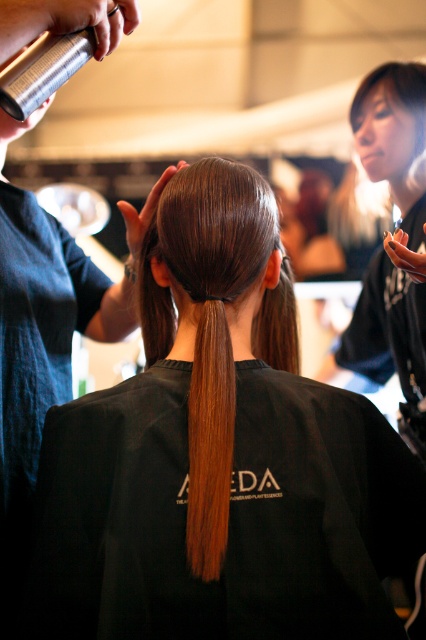
Is smooth black hair at upper right below shiny brown hair at center?

Incorrect, smooth black hair at upper right is not positioned below shiny brown hair at center.

Is smooth black hair at upper right wider than shiny brown hair at center?

Yes, smooth black hair at upper right is wider than shiny brown hair at center.

The image size is (426, 640). In order to click on smooth black hair at upper right in this screenshot , I will do 393,244.

Locate an element on the screen. smooth black hair at upper right is located at coordinates (393, 244).

Between brown shiny hair at center and shiny brown hair at center, which one is positioned higher?

shiny brown hair at center is above.

Does brown shiny hair at center have a greater height compared to shiny brown hair at center?

Yes.

Is point (232, 413) less distant than point (201, 545)?

No, it is not.

At what (x,y) coordinates should I click in order to perform the action: click on brown shiny hair at center. Please return your answer as a coordinate pair (x, y). Looking at the image, I should click on (219, 458).

Can you confirm if brown shiny hair at center is thinner than shiny brown ponytail at center?

In fact, brown shiny hair at center might be wider than shiny brown ponytail at center.

In order to click on brown shiny hair at center in this screenshot , I will do `click(219, 458)`.

What do you see at coordinates (219, 458) in the screenshot?
I see `brown shiny hair at center` at bounding box center [219, 458].

Where is `brown shiny hair at center`? brown shiny hair at center is located at coordinates (219, 458).